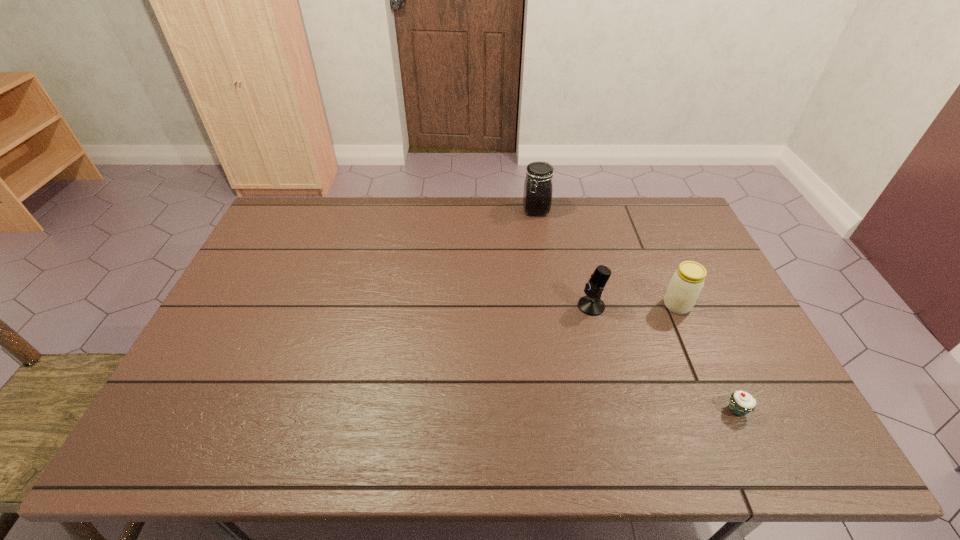
Where is `free location located 0.370m on the stand of the microphone`? Image resolution: width=960 pixels, height=540 pixels. free location located 0.370m on the stand of the microphone is located at coordinates (451, 306).

The image size is (960, 540). In order to click on free space located 0.130m on the front of the right jar in this screenshot , I will do `click(698, 353)`.

At what (x,y) coordinates should I click in order to perform the action: click on vacant space located on the front of the shortest object. Please return your answer as a coordinate pair (x, y). Image resolution: width=960 pixels, height=540 pixels. Looking at the image, I should click on (752, 442).

This screenshot has width=960, height=540. Find the location of `object at the far edge`. object at the far edge is located at coordinates (537, 197).

Image resolution: width=960 pixels, height=540 pixels. Find the location of `jar that is positioned at the right edge`. jar that is positioned at the right edge is located at coordinates (686, 284).

What are the coordinates of `cupcake that is positioned at the right edge` in the screenshot? It's located at (740, 403).

This screenshot has height=540, width=960. I want to click on vacant region at the far edge of the desktop, so click(x=435, y=197).

Identify the location of free space at the near edge of the desktop. Image resolution: width=960 pixels, height=540 pixels. (487, 422).

Find the location of a particular element. The height and width of the screenshot is (540, 960). vacant space at the left edge of the desktop is located at coordinates pyautogui.click(x=245, y=361).

The width and height of the screenshot is (960, 540). Find the location of `vacant area at the far left corner`. vacant area at the far left corner is located at coordinates (311, 219).